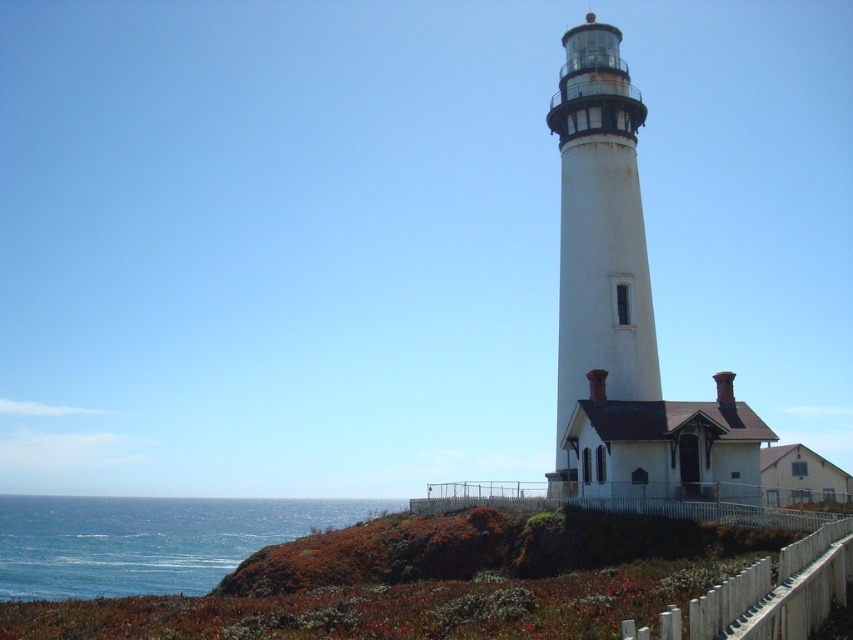
Question: Which point is closer to the camera taking this photo?

Choices:
 (A) (566, 378)
 (B) (38, 518)

Answer: (A)

Question: Can you confirm if white painted metal tower at center is thinner than blue water at lower left?

Choices:
 (A) yes
 (B) no

Answer: (A)

Question: Among these points, which one is farthest from the camera?

Choices:
 (A) (608, 145)
 (B) (80, 541)

Answer: (B)

Question: Among these points, which one is farthest from the camera?

Choices:
 (A) (560, 449)
 (B) (265, 528)

Answer: (B)

Question: Can you confirm if white painted metal tower at center is thinner than blue water at lower left?

Choices:
 (A) no
 (B) yes

Answer: (B)

Question: Can you confirm if white painted metal tower at center is positioned above blue water at lower left?

Choices:
 (A) no
 (B) yes

Answer: (B)